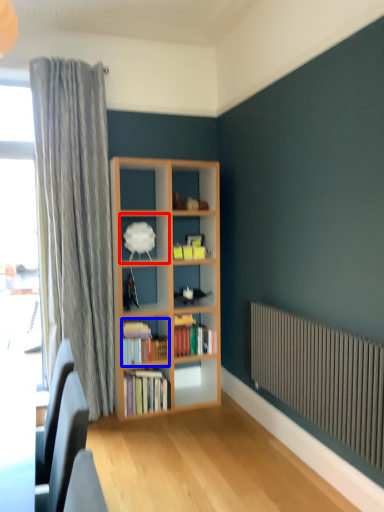
Question: Which point is closer to the camera, shelf (highlighted by a red box) or book (highlighted by a blue box)?

Choices:
 (A) shelf
 (B) book

Answer: (A)